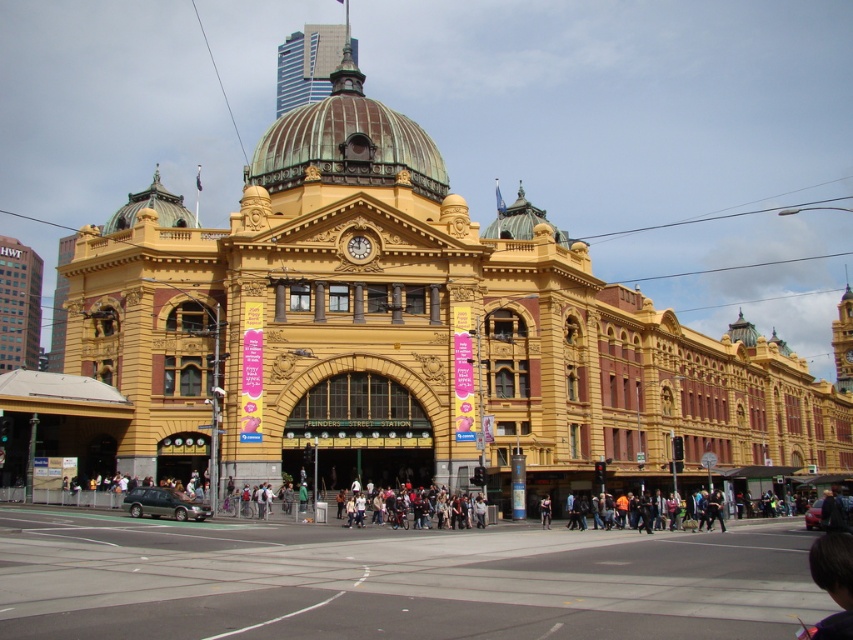
You are standing at point (347,141) in the Flinders Street Station image. What architectural feature is located exactly at your current position?

The green copper dome at center is located exactly at point (347,141).

You are standing at Flinders Street Station and want to take a photo of the green copper dome at center. However, there is a matte black backpack at center blocking your view. Can you still see the dome clearly?

The green copper dome at center is larger than the matte black backpack at center, so you can still see the dome clearly as it is bigger in size.